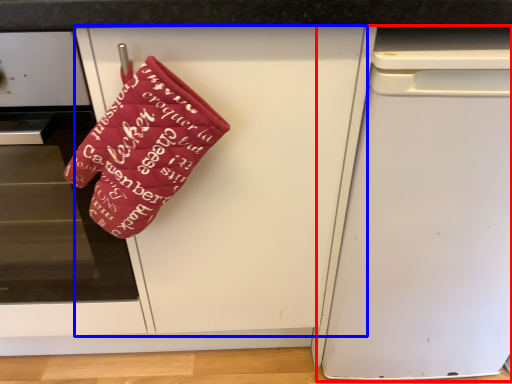
Question: Which of the following is the closest to the observer, dish washer (highlighted by a red box) or door (highlighted by a blue box)?

Choices:
 (A) dish washer
 (B) door

Answer: (B)